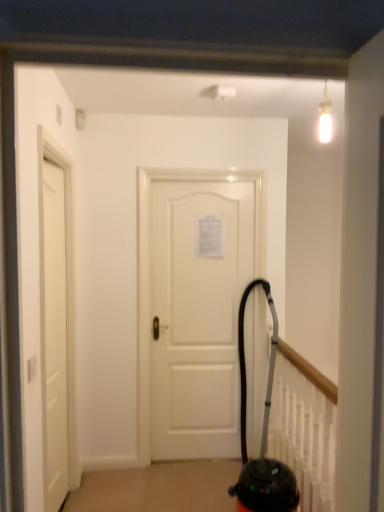
Find the location of a particular element. This screenshot has width=384, height=512. free space above white matte door at center, marked as the 2th door in a front-to-back arrangement (from a real-world perspective) is located at coordinates (196, 163).